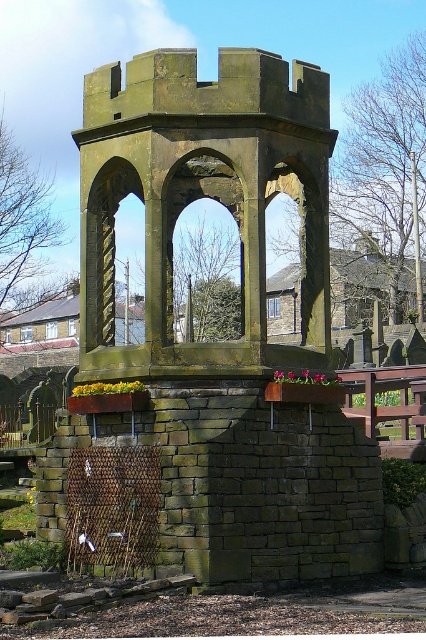
Where is `carved stone archway at center`? carved stone archway at center is located at coordinates (101, 248).

What are the coordinates of `carved stone archway at center` in the screenshot? It's located at (101, 248).

Is green stone gazebo at center below rusty stone archway at center?

Actually, green stone gazebo at center is above rusty stone archway at center.

Who is more forward, [86,216] or [167,266]?

Point [86,216] is in front.

The height and width of the screenshot is (640, 426). In order to click on green stone gazebo at center in this screenshot , I will do `click(201, 196)`.

Is point (259, 273) behind point (104, 225)?

No.

Is point (305, 88) less distant than point (94, 228)?

No, it is not.

Who is more forward, (213, 84) or (85, 307)?

Positioned in front is point (213, 84).

Image resolution: width=426 pixels, height=640 pixels. What are the coordinates of `green stone gazebo at center` in the screenshot? It's located at (201, 196).